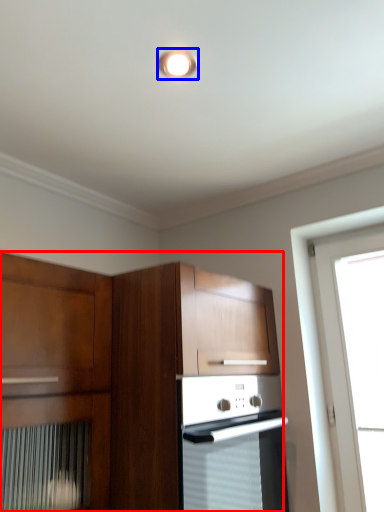
Question: Among these objects, which one is farthest to the camera, cabinetry (highlighted by a red box) or light fixture (highlighted by a blue box)?

Choices:
 (A) cabinetry
 (B) light fixture

Answer: (B)